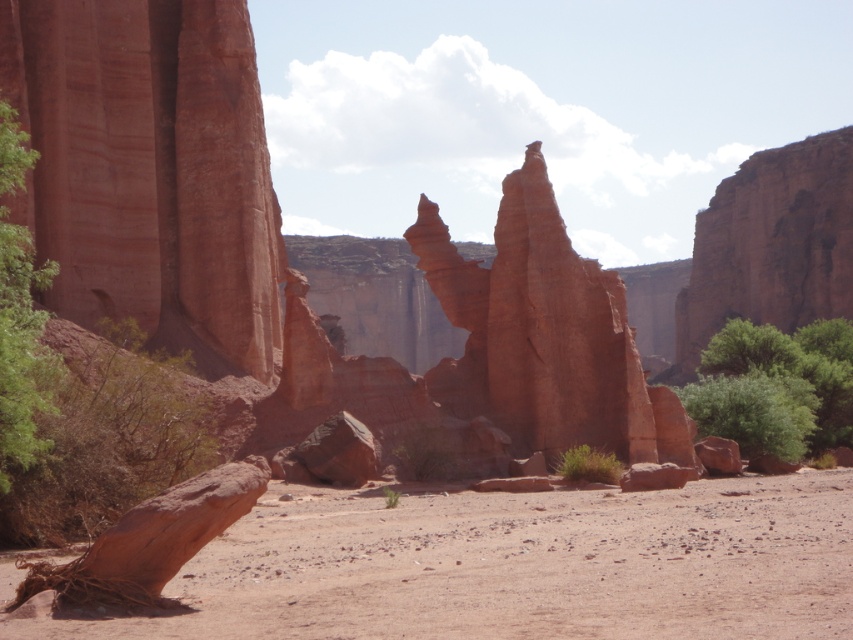
Question: Which of these objects is positioned farthest from the green leafy bush at lower left?

Choices:
 (A) smooth sandstone rock formation at center
 (B) dull reddish-brown rock at lower left
 (C) green leafy bush at left

Answer: (A)

Question: Can you confirm if green leafy bush at lower left is bigger than green leafy tree at lower right?

Choices:
 (A) yes
 (B) no

Answer: (B)

Question: Does green leafy bush at lower left appear on the right side of green leafy bush at center?

Choices:
 (A) yes
 (B) no

Answer: (B)

Question: Does green leafy tree at lower right have a larger size compared to green leafy bush at left?

Choices:
 (A) yes
 (B) no

Answer: (A)

Question: Which of the following is the closest to the observer?

Choices:
 (A) smooth sandstone rock formation at center
 (B) dull reddish-brown rock at lower left
 (C) green leafy bush at left

Answer: (B)

Question: Which of the following is the farthest from the observer?

Choices:
 (A) (25, 250)
 (B) (514, 436)
 (C) (572, 467)

Answer: (B)